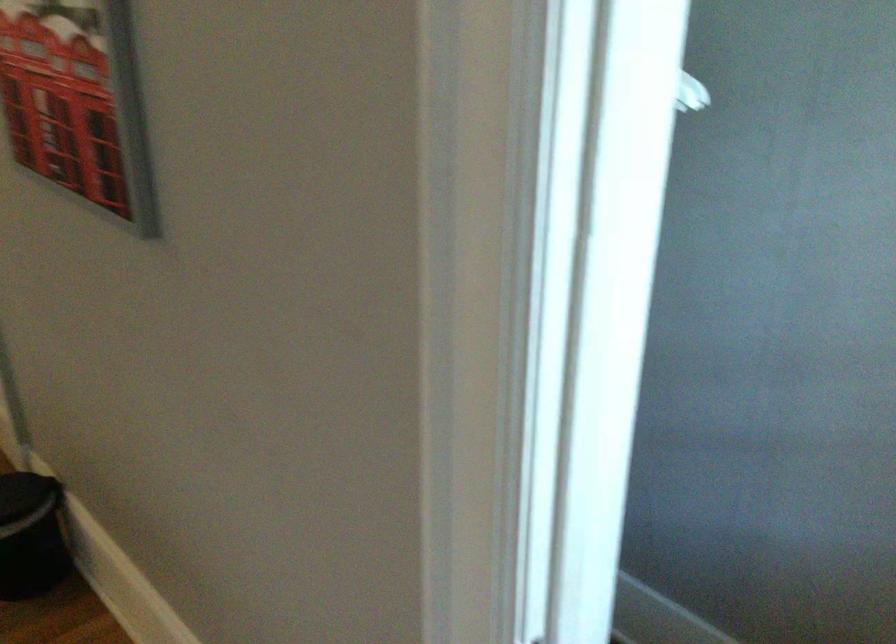
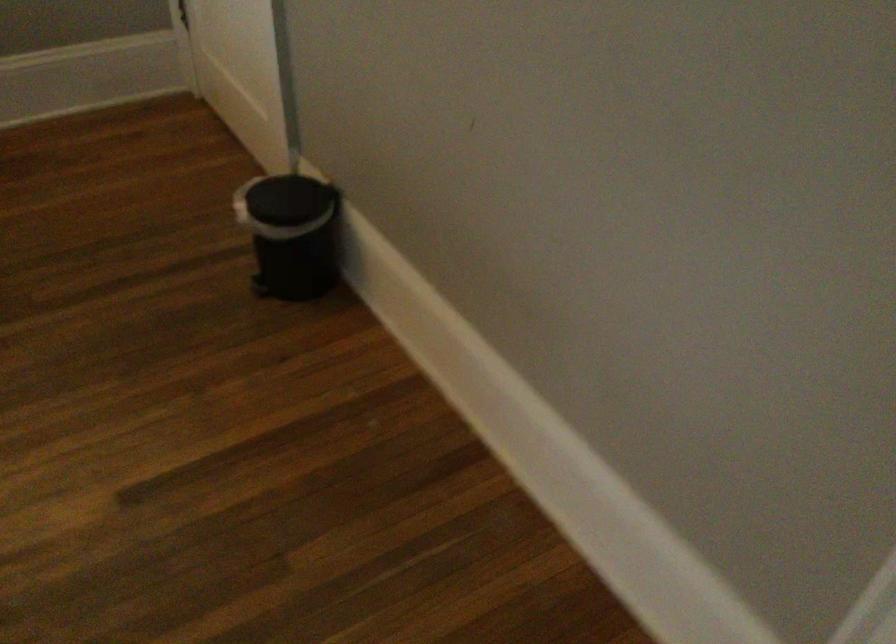
Question: In a continuous first-person perspective shot, in which direction is the camera moving?

Choices:
 (A) Left
 (B) Right
 (C) Forward
 (D) Backward

Answer: (A)